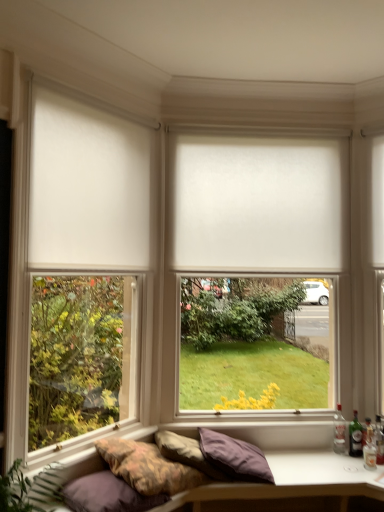
Where is `free space above white matte curtain at left (from a real-world perspective)`? The image size is (384, 512). free space above white matte curtain at left (from a real-world perspective) is located at coordinates (100, 105).